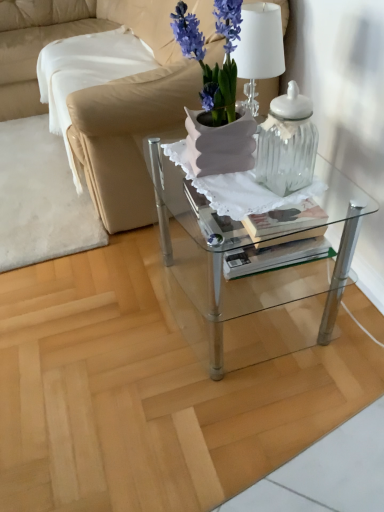
Question: From the image's perspective, is purple matte vase at center beneath clear glass table at center?

Choices:
 (A) no
 (B) yes

Answer: (A)

Question: Considering the relative sizes of purple matte vase at center and clear glass table at center in the image provided, is purple matte vase at center wider than clear glass table at center?

Choices:
 (A) no
 (B) yes

Answer: (A)

Question: Does purple matte vase at center appear on the right side of clear glass table at center?

Choices:
 (A) yes
 (B) no

Answer: (B)

Question: Does purple matte vase at center have a lesser height compared to clear glass table at center?

Choices:
 (A) yes
 (B) no

Answer: (A)

Question: From the image's perspective, does purple matte vase at center appear higher than clear glass table at center?

Choices:
 (A) yes
 (B) no

Answer: (A)

Question: Is purple matte vase at center oriented away from clear glass table at center?

Choices:
 (A) no
 (B) yes

Answer: (A)

Question: Does clear glass table at center lie in front of purple matte vase at center?

Choices:
 (A) no
 (B) yes

Answer: (A)

Question: Considering the relative sizes of clear glass table at center and purple matte vase at center in the image provided, is clear glass table at center smaller than purple matte vase at center?

Choices:
 (A) yes
 (B) no

Answer: (B)

Question: Does clear glass table at center touch purple matte vase at center?

Choices:
 (A) yes
 (B) no

Answer: (B)

Question: Is clear glass table at center behind purple matte vase at center?

Choices:
 (A) no
 (B) yes

Answer: (B)

Question: Is clear glass table at center at the right side of purple matte vase at center?

Choices:
 (A) yes
 (B) no

Answer: (A)

Question: Is clear glass table at center facing away from purple matte vase at center?

Choices:
 (A) yes
 (B) no

Answer: (B)

Question: Is purple matte vase at center at the back of beige leather couch at upper left?

Choices:
 (A) no
 (B) yes

Answer: (A)